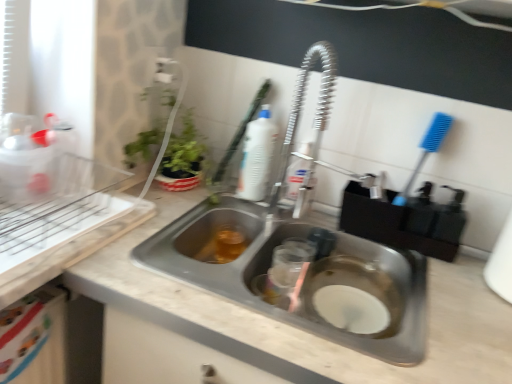
This screenshot has height=384, width=512. What do you see at coordinates (314, 335) in the screenshot? I see `metallic stainless steel sink at center` at bounding box center [314, 335].

Identify the location of translucent plastic bottle at center, positioned as the 2th cleaning product in left-to-right order. This screenshot has height=384, width=512. tap(297, 172).

Is point (339, 336) less distant than point (298, 185)?

Yes, it is.

Is stainless steel sink at center bigger than translucent plastic bottle at center, marked as the 1th cleaning product in a right-to-left arrangement?

Indeed, stainless steel sink at center has a larger size compared to translucent plastic bottle at center, marked as the 1th cleaning product in a right-to-left arrangement.

Measure the distance between stainless steel sink at center and translucent plastic bottle at center, marked as the 1th cleaning product in a right-to-left arrangement.

They are 23.28 centimeters apart.

Is stainless steel sink at center inside or outside of translucent plastic bottle at center, marked as the 1th cleaning product in a right-to-left arrangement?

stainless steel sink at center exists outside the volume of translucent plastic bottle at center, marked as the 1th cleaning product in a right-to-left arrangement.

Are white plastic brush at upper center and white plastic bottle at upper center, which is the 1th cleaning product in left-to-right order, located far from each other?

That's not correct — white plastic brush at upper center is a little close to white plastic bottle at upper center, which is the 1th cleaning product in left-to-right order.

Between white plastic brush at upper center and white plastic bottle at upper center, the second cleaning product positioned from the right, which one has more height?

Standing taller between the two is white plastic brush at upper center.

Is white plastic brush at upper center looking in the opposite direction of white plastic bottle at upper center, which is the 1th cleaning product in left-to-right order?

That's right, white plastic brush at upper center is facing away from white plastic bottle at upper center, which is the 1th cleaning product in left-to-right order.

Starting from the white plastic brush at upper center, which cleaning product is the 1st one to the right? Please provide its 2D coordinates.

[(257, 157)]

Considering the positions of objects metallic stainless steel sink at center and white plastic brush at upper center in the image provided, who is more to the left, metallic stainless steel sink at center or white plastic brush at upper center?

Positioned to the left is white plastic brush at upper center.

Which of these two, metallic stainless steel sink at center or white plastic brush at upper center, stands shorter?

metallic stainless steel sink at center.

Is metallic stainless steel sink at center in front of white plastic brush at upper center?

Yes, it is in front of white plastic brush at upper center.

Is point (483, 330) positioned after point (253, 115)?

No, (483, 330) is closer to viewer.

Image resolution: width=512 pixels, height=384 pixels. I want to click on sink that is in front of the translucent plastic bottle at center, positioned as the 2th cleaning product in left-to-right order, so click(306, 259).

Considering the points (288, 169) and (318, 283), which point is behind, point (288, 169) or point (318, 283)?

The point (288, 169) is farther from the camera.

Is translucent plastic bottle at center, marked as the 1th cleaning product in a right-to-left arrangement, positioned with its back to stainless steel sink at center?

Correct, translucent plastic bottle at center, marked as the 1th cleaning product in a right-to-left arrangement, is looking away from stainless steel sink at center.

Between translucent plastic bottle at center, positioned as the 2th cleaning product in left-to-right order, and stainless steel sink at center, which one appears on the right side from the viewer's perspective?

stainless steel sink at center is more to the right.

Considering the sizes of objects white plastic bottle at upper center, which is the 1th cleaning product in left-to-right order, and metallic stainless steel sink at center in the image provided, who is thinner, white plastic bottle at upper center, which is the 1th cleaning product in left-to-right order, or metallic stainless steel sink at center?

With smaller width is white plastic bottle at upper center, which is the 1th cleaning product in left-to-right order.

From the image's perspective, which one is positioned lower, white plastic bottle at upper center, which is the 1th cleaning product in left-to-right order, or metallic stainless steel sink at center?

metallic stainless steel sink at center appears lower in the image.

Measure the distance between white plastic bottle at upper center, which is the 1th cleaning product in left-to-right order, and metallic stainless steel sink at center.

15.26 inches.

What's the angular difference between white plastic bottle at upper center, the second cleaning product positioned from the right, and metallic stainless steel sink at center's facing directions?

They differ by 1.42 degrees in their facing directions.

From the image's perspective, is stainless steel sink at center positioned above or below white plastic brush at upper center?

Clearly, from the image's perspective, stainless steel sink at center is below white plastic brush at upper center.

Based on their sizes in the image, would you say stainless steel sink at center is bigger or smaller than white plastic brush at upper center?

Considering their sizes, stainless steel sink at center takes up more space than white plastic brush at upper center.

Is stainless steel sink at center oriented towards white plastic brush at upper center?

No, stainless steel sink at center is not oriented towards white plastic brush at upper center.

You are a GUI agent. You are given a task and a screenshot of the screen. Output one action in this format:
    pyautogui.click(x=<x>, y=<y>)
    Task: Click on the sink on the right of white plastic brush at upper center
    The height and width of the screenshot is (384, 512).
    Given the screenshot: What is the action you would take?
    pyautogui.click(x=306, y=259)

There is a metallic stainless steel sink at center. At what (x,y) coordinates should I click in order to perform the action: click on the 1st cleaning product above it (from a real-world perspective). Please return your answer as a coordinate pair (x, y). This screenshot has height=384, width=512. Looking at the image, I should click on (297, 172).

From a real-world perspective, is translucent plastic bottle at center, marked as the 1th cleaning product in a right-to-left arrangement, on top of metallic stainless steel sink at center?

Yes, from a real-world perspective, translucent plastic bottle at center, marked as the 1th cleaning product in a right-to-left arrangement, is over metallic stainless steel sink at center

What's the angular difference between translucent plastic bottle at center, positioned as the 2th cleaning product in left-to-right order, and metallic stainless steel sink at center's facing directions?

There is a 17.5-degree angle between the facing directions of translucent plastic bottle at center, positioned as the 2th cleaning product in left-to-right order, and metallic stainless steel sink at center.

Who is bigger, translucent plastic bottle at center, positioned as the 2th cleaning product in left-to-right order, or metallic stainless steel sink at center?

metallic stainless steel sink at center.

There is a translucent plastic bottle at center, marked as the 1th cleaning product in a right-to-left arrangement. Identify the location of sink above it (from a real-world perspective). The image size is (512, 384). (306, 259).

The width and height of the screenshot is (512, 384). In order to click on the 1st cleaning product behind when counting from the white plastic brush at upper center in this screenshot , I will do `click(257, 157)`.

Which object lies further to the anchor point white plastic brush at upper center, translucent amber liquid at sink left or white plastic bottle at upper center, which is the 1th cleaning product in left-to-right order?

The object further to white plastic brush at upper center is translucent amber liquid at sink left.

When comparing their distances from translucent amber liquid at sink left, does white plastic brush at upper center or translucent plastic bottle at center, marked as the 1th cleaning product in a right-to-left arrangement, seem closer?

translucent plastic bottle at center, marked as the 1th cleaning product in a right-to-left arrangement, lies closer to translucent amber liquid at sink left than the other object.

From the image, which object appears to be farther from translucent amber liquid at sink left, white plastic bottle at upper center, which is the 1th cleaning product in left-to-right order, or white plastic brush at upper center?

white plastic brush at upper center is positioned further to the anchor translucent amber liquid at sink left.

Based on their spatial positions, is translucent plastic bottle at center, positioned as the 2th cleaning product in left-to-right order, or white plastic bottle at upper center, the second cleaning product positioned from the right, further from translucent amber liquid at sink left?

Among the two, translucent plastic bottle at center, positioned as the 2th cleaning product in left-to-right order, is located further to translucent amber liquid at sink left.

From the image, which object appears to be nearer to metallic stainless steel sink at center, stainless steel sink at center or translucent amber liquid at sink left?

stainless steel sink at center lies closer to metallic stainless steel sink at center than the other object.

When comparing their distances from translucent amber liquid at sink left, does translucent plastic bottle at center, positioned as the 2th cleaning product in left-to-right order, or metallic stainless steel sink at center seem further?

metallic stainless steel sink at center is further to translucent amber liquid at sink left.

Looking at the image, which one is located closer to metallic stainless steel sink at center, translucent amber liquid at sink left or white plastic brush at upper center?

The object closer to metallic stainless steel sink at center is translucent amber liquid at sink left.

Estimate the real-world distances between objects in this image. Which object is closer to translucent plastic bottle at center, marked as the 1th cleaning product in a right-to-left arrangement, white plastic bottle at upper center, which is the 1th cleaning product in left-to-right order, or translucent amber liquid at sink left?

white plastic bottle at upper center, which is the 1th cleaning product in left-to-right order.

At what (x,y) coordinates should I click in order to perform the action: click on brush between stainless steel sink at center and translucent plastic bottle at center, positioned as the 2th cleaning product in left-to-right order, in the front-back direction. Please return your answer as a coordinate pair (x, y). The width and height of the screenshot is (512, 384). Looking at the image, I should click on (240, 132).

This screenshot has width=512, height=384. Find the location of `brush between stainless steel sink at center and translucent amber liquid at sink left in the front-back direction`. brush between stainless steel sink at center and translucent amber liquid at sink left in the front-back direction is located at coordinates (240, 132).

The width and height of the screenshot is (512, 384). What are the coordinates of `cleaning product positioned between stainless steel sink at center and translucent plastic bottle at center, positioned as the 2th cleaning product in left-to-right order, from near to far` in the screenshot? It's located at (257, 157).

The height and width of the screenshot is (384, 512). In order to click on sink that lies between white plastic brush at upper center and metallic stainless steel sink at center from top to bottom in this screenshot , I will do `click(306, 259)`.